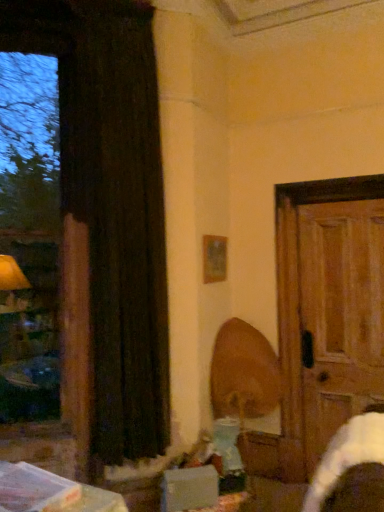
Question: Can you confirm if wooden swivel chair at center is wider than black velvet curtain at left?

Choices:
 (A) yes
 (B) no

Answer: (A)

Question: Does wooden swivel chair at center have a lesser height compared to black velvet curtain at left?

Choices:
 (A) no
 (B) yes

Answer: (B)

Question: Can we say wooden swivel chair at center lies outside black velvet curtain at left?

Choices:
 (A) yes
 (B) no

Answer: (A)

Question: Is wooden swivel chair at center at the right side of black velvet curtain at left?

Choices:
 (A) no
 (B) yes

Answer: (B)

Question: From a real-world perspective, is wooden swivel chair at center physically above black velvet curtain at left?

Choices:
 (A) no
 (B) yes

Answer: (A)

Question: Does point (370, 361) appear closer or farther from the camera than point (246, 403)?

Choices:
 (A) farther
 (B) closer

Answer: (B)

Question: In terms of width, does wooden door at right look wider or thinner when compared to wooden swivel chair at center?

Choices:
 (A) wide
 (B) thin

Answer: (B)

Question: In terms of size, does wooden door at right appear bigger or smaller than wooden swivel chair at center?

Choices:
 (A) small
 (B) big

Answer: (A)

Question: From the image's perspective, relative to wooden swivel chair at center, is wooden door at right above or below?

Choices:
 (A) below
 (B) above

Answer: (B)

Question: In terms of height, does black velvet curtain at left look taller or shorter compared to wooden picture frame at upper center?

Choices:
 (A) tall
 (B) short

Answer: (A)

Question: Visually, is black velvet curtain at left positioned to the left or to the right of wooden picture frame at upper center?

Choices:
 (A) right
 (B) left

Answer: (B)

Question: Choose the correct answer: Is black velvet curtain at left inside wooden picture frame at upper center or outside it?

Choices:
 (A) inside
 (B) outside

Answer: (B)

Question: Looking at the image, does black velvet curtain at left seem bigger or smaller compared to wooden picture frame at upper center?

Choices:
 (A) small
 (B) big

Answer: (B)

Question: Is wooden swivel chair at center to the left or to the right of black velvet curtain at left in the image?

Choices:
 (A) left
 (B) right

Answer: (B)

Question: In terms of width, does wooden swivel chair at center look wider or thinner when compared to black velvet curtain at left?

Choices:
 (A) thin
 (B) wide

Answer: (B)